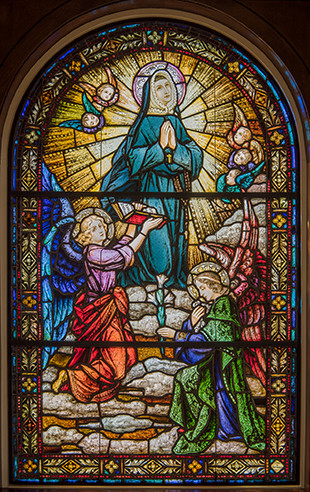
This screenshot has height=492, width=310. In order to click on book in this screenshot , I will do `click(135, 214)`.